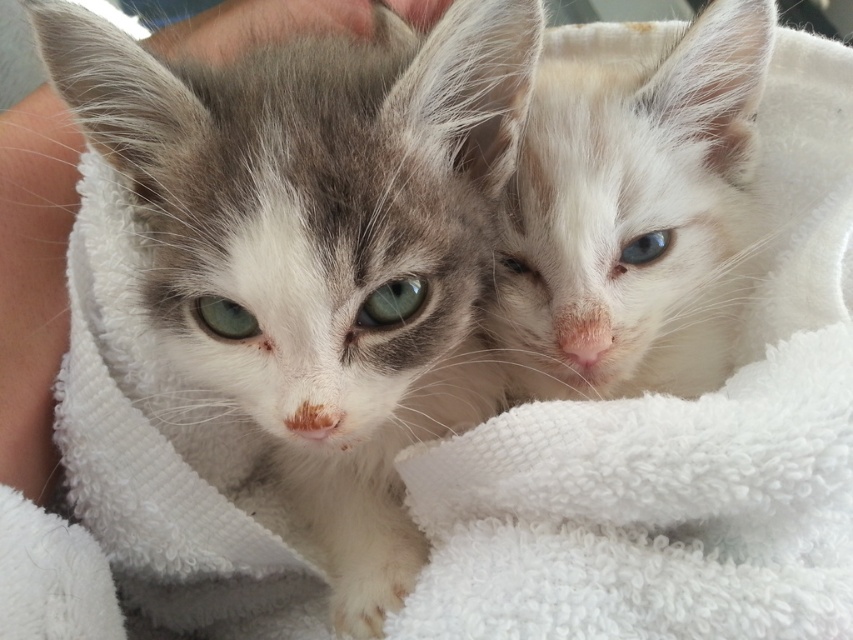
Does green matte eye at center have a lesser height compared to white fur eye at upper center?

Incorrect, green matte eye at center's height does not fall short of white fur eye at upper center's.

Between green matte eye at center and white fur eye at upper center, which one appears on the right side from the viewer's perspective?

white fur eye at upper center is more to the right.

Describe the element at coordinates (223, 317) in the screenshot. I see `green matte eye at center` at that location.

This screenshot has height=640, width=853. I want to click on green matte eye at center, so click(223, 317).

How distant is soft gray fur kitten at left from white fluffy cat at upper right?

soft gray fur kitten at left is 23.16 centimeters from white fluffy cat at upper right.

How far apart are soft gray fur kitten at left and white fluffy cat at upper right?

The distance of soft gray fur kitten at left from white fluffy cat at upper right is 9.12 inches.

Is point (213, 115) positioned before point (596, 307)?

That is True.

Where is `soft gray fur kitten at left`? soft gray fur kitten at left is located at coordinates (321, 243).

Does blue glossy eye at upper right have a lesser height compared to white fur eye at upper center?

In fact, blue glossy eye at upper right may be taller than white fur eye at upper center.

Between blue glossy eye at upper right and white fur eye at upper center, which one has more height?

blue glossy eye at upper right

Is point (659, 243) positioned after point (526, 264)?

That is False.

At what (x,y) coordinates should I click in order to perform the action: click on blue glossy eye at upper right. Please return your answer as a coordinate pair (x, y). Looking at the image, I should click on (646, 248).